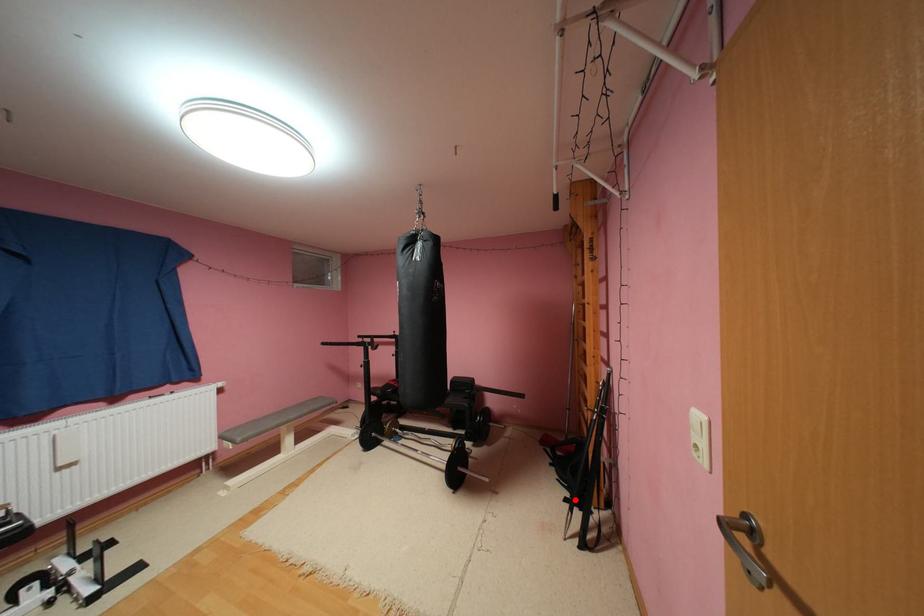
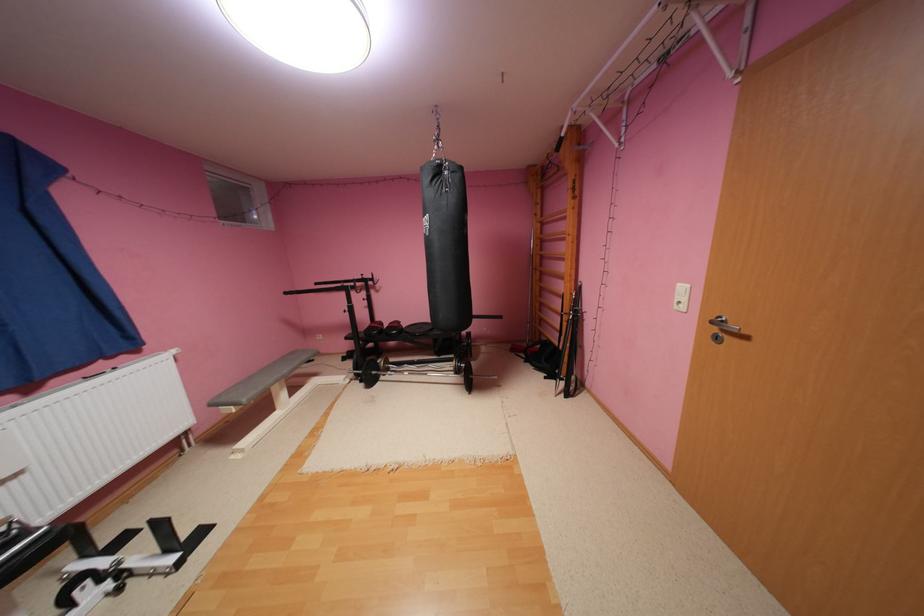
Question: I am providing you with two images of the same scene from different viewpoints. In image1, a red point is highlighted. Considering the same 3D point in image2, which of the following is correct?

Choices:
 (A) It is closer
 (B) It is farther

Answer: (B)